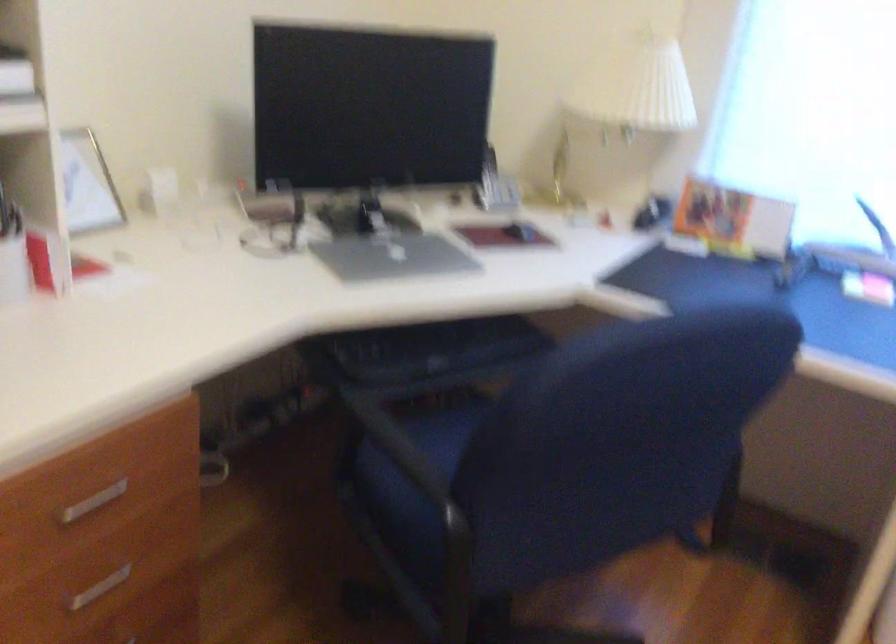
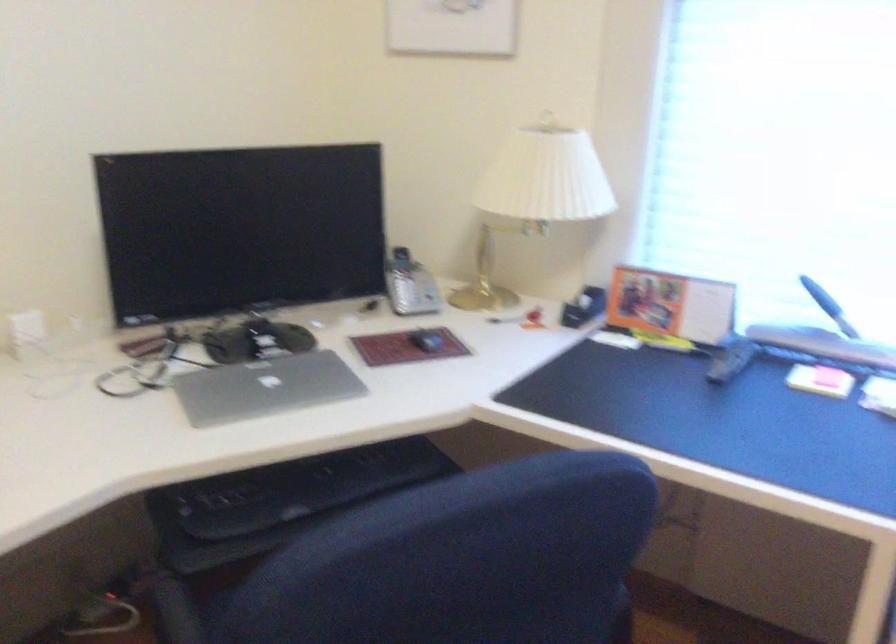
Question: How did the camera likely rotate?

Choices:
 (A) Left
 (B) Right
 (C) Up
 (D) Down

Answer: (C)